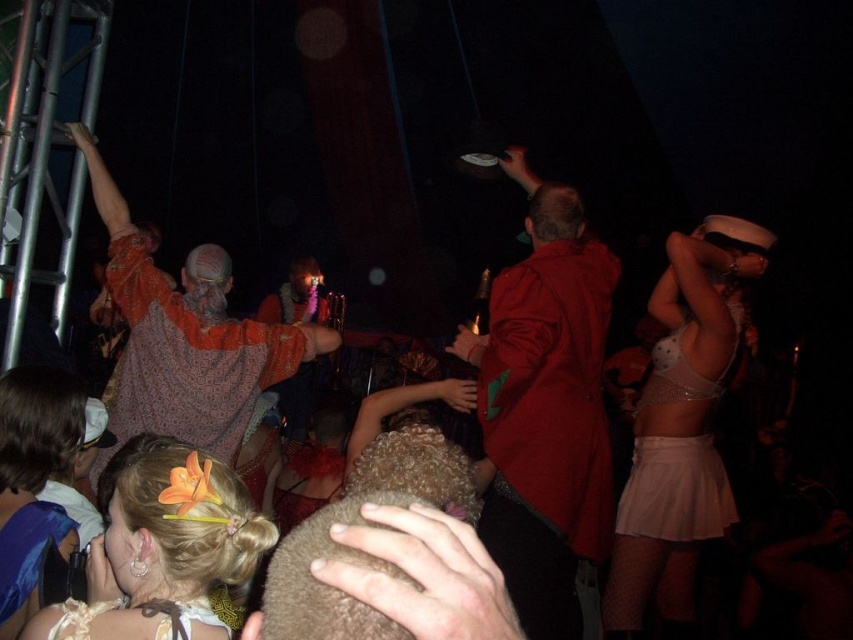
You are standing at the center of the image and want to locate the white mesh skirt at upper right. Which direction should you look to find it?

The white mesh skirt at upper right is located at point 0.667 on the x axis and 0.800 on the y axis, so you should look to the upper right direction to find it.

You are at a party and want to find the white mesh skirt at upper right and the patterned fabric shirt at upper left. Based on their positions, which one is located to the right side of the other?

The white mesh skirt at upper right is to the right of the patterned fabric shirt at upper left.

You are at a party and want to find the matte red jacket at center and the pink satin skirt at lower right. Which one is taller from your perspective?

The matte red jacket at center is much taller than the pink satin skirt at lower right.